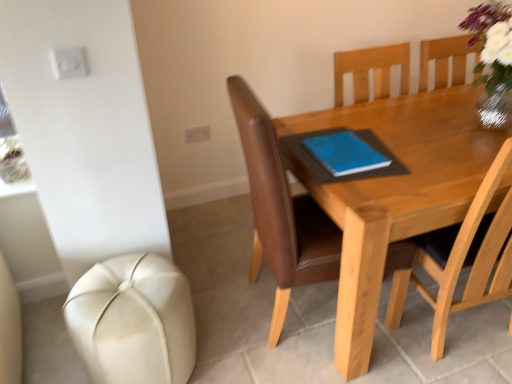
The width and height of the screenshot is (512, 384). Find the location of `vacant space situated above white leather ottoman at lower left (from a real-world perspective)`. vacant space situated above white leather ottoman at lower left (from a real-world perspective) is located at coordinates (116, 298).